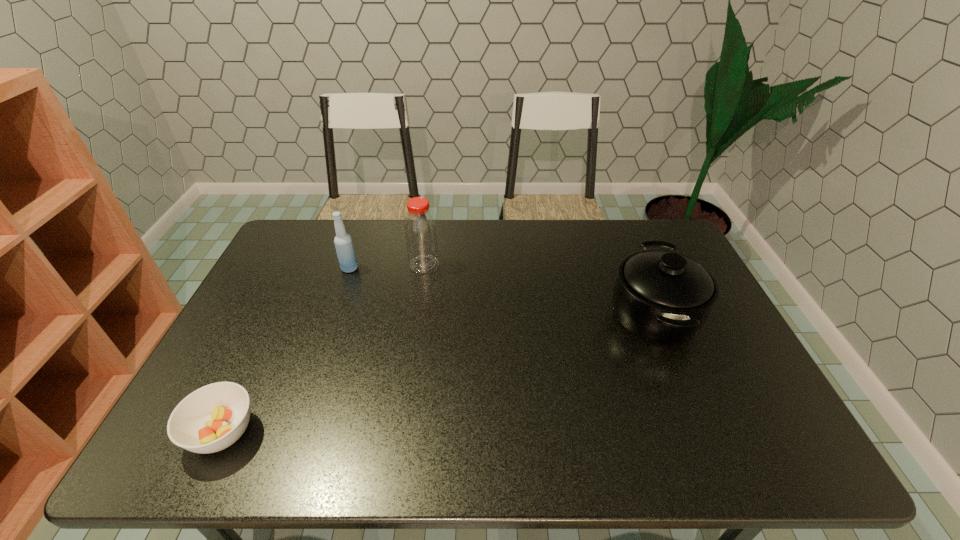
Image resolution: width=960 pixels, height=540 pixels. I want to click on the second object from right to left, so click(420, 229).

Identify the location of the second object from left to right. The width and height of the screenshot is (960, 540). (345, 251).

You are a GUI agent. You are given a task and a screenshot of the screen. Output one action in this format:
    pyautogui.click(x=<x>, y=<y>)
    Task: Click on the saucepan
    The height and width of the screenshot is (540, 960).
    Given the screenshot: What is the action you would take?
    pyautogui.click(x=661, y=296)

This screenshot has width=960, height=540. I want to click on the shortest object, so click(213, 417).

At what (x,y) coordinates should I click in order to perform the action: click on the leftmost object. Please return your answer as a coordinate pair (x, y). The width and height of the screenshot is (960, 540). Looking at the image, I should click on (213, 417).

Where is `free space located on the right of the right bottle`? This screenshot has height=540, width=960. free space located on the right of the right bottle is located at coordinates (500, 265).

This screenshot has height=540, width=960. Identify the location of vacant area situated on the back of the third object from right to left. (367, 219).

You are a GUI agent. You are given a task and a screenshot of the screen. Output one action in this format:
    pyautogui.click(x=<x>, y=<y>)
    Task: Click on the vacant space located on the front of the saucepan
    This screenshot has width=960, height=540.
    Given the screenshot: What is the action you would take?
    pyautogui.click(x=717, y=462)

At what (x,y) coordinates should I click in order to perform the action: click on vacant point located on the back of the leftmost object. Please return your answer as a coordinate pair (x, y). The image size is (960, 540). Looking at the image, I should click on click(289, 294).

Where is `object that is positioned at the far edge`? Image resolution: width=960 pixels, height=540 pixels. object that is positioned at the far edge is located at coordinates (420, 229).